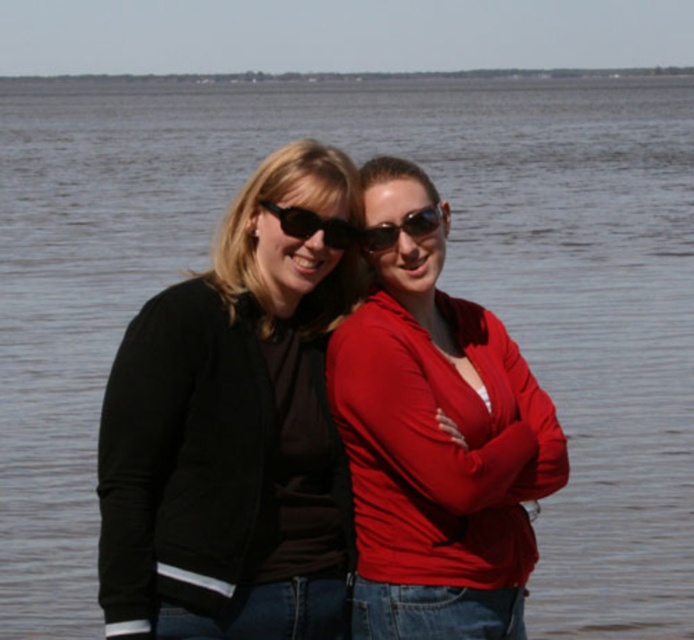
From the picture: Who is more distant from viewer, (391, 445) or (332, 228)?

The point (332, 228) is behind.

I want to click on matte red jacket at center, so click(437, 440).

Where is `matte red jacket at center`? Image resolution: width=694 pixels, height=640 pixels. matte red jacket at center is located at coordinates (437, 440).

Is matte red jacket at center smaller than sunglasses at center?

Incorrect, matte red jacket at center is not smaller in size than sunglasses at center.

Between point (396, 540) and point (416, 230), which one is positioned behind?

The point (416, 230) is behind.

Locate an element on the screen. matte red jacket at center is located at coordinates (437, 440).

What do you see at coordinates (232, 429) in the screenshot? This screenshot has width=694, height=640. I see `black matte jacket at left` at bounding box center [232, 429].

I want to click on black matte jacket at left, so click(232, 429).

Is point (192, 554) more distant than point (296, 228)?

No.

You are a GUI agent. You are given a task and a screenshot of the screen. Output one action in this format:
    pyautogui.click(x=<x>, y=<y>)
    Task: Click on the black matte jacket at left
    The width and height of the screenshot is (694, 640).
    Given the screenshot: What is the action you would take?
    pyautogui.click(x=232, y=429)